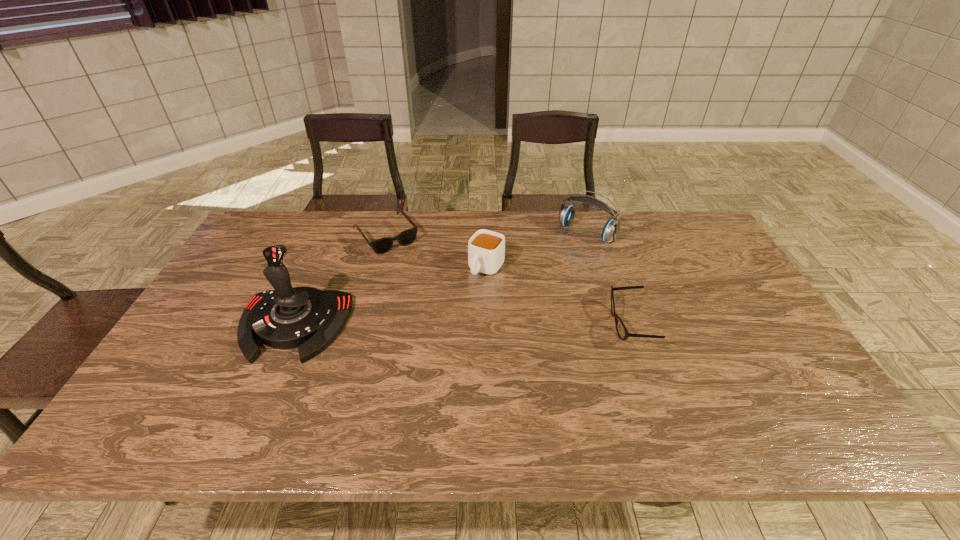
Locate an element on the screen. free space on the desktop that is between the joystick and the spectacles and is positioned at the front lenses of the sunglasses is located at coordinates (458, 325).

Where is `vacant spot on the desktop that is between the tallest object and the spectacles and is positioned on the ear cups of the fourth shortest object`? This screenshot has height=540, width=960. vacant spot on the desktop that is between the tallest object and the spectacles and is positioned on the ear cups of the fourth shortest object is located at coordinates (500, 325).

The height and width of the screenshot is (540, 960). Find the location of `free spot on the desktop that is between the joystick and the spectacles and is positioned on the side with the handle of the cup`. free spot on the desktop that is between the joystick and the spectacles and is positioned on the side with the handle of the cup is located at coordinates (444, 325).